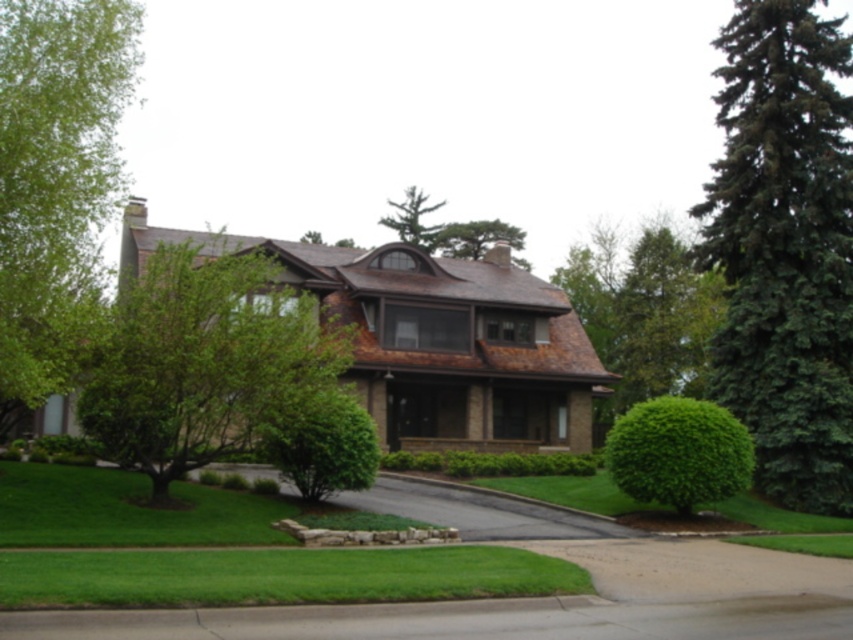
Question: Where is green leafy tree at upper right located in relation to green leafy tree at upper center in the image?

Choices:
 (A) above
 (B) below

Answer: (B)

Question: Which point is closer to the camera?

Choices:
 (A) (424, 468)
 (B) (84, 208)
 (C) (598, 346)
 (D) (264, 452)

Answer: (D)

Question: Based on their relative distances, which object is farther from the green leafy tree at left?

Choices:
 (A) green leafy tree at upper right
 (B) green leafy bush at center

Answer: (A)

Question: Which point is farther to the camera?

Choices:
 (A) (x=450, y=593)
 (B) (x=55, y=138)
 (C) (x=422, y=205)
 (D) (x=637, y=378)

Answer: (C)

Question: Is green leafy bush at center right smaller than green leafy bush at center?

Choices:
 (A) yes
 (B) no

Answer: (B)

Question: Does green fir at right appear under green textured tree at upper center?

Choices:
 (A) no
 (B) yes

Answer: (A)